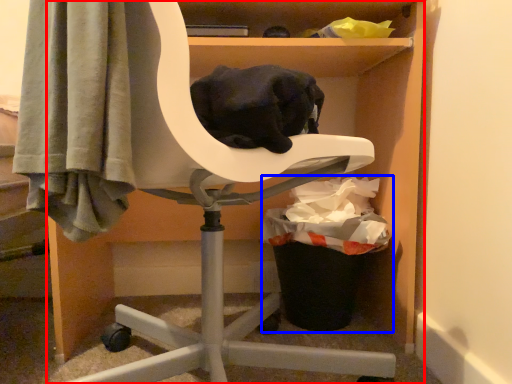
Question: Which of the following is the closest to the observer, furniture (highlighted by a red box) or garbage (highlighted by a blue box)?

Choices:
 (A) furniture
 (B) garbage

Answer: (A)